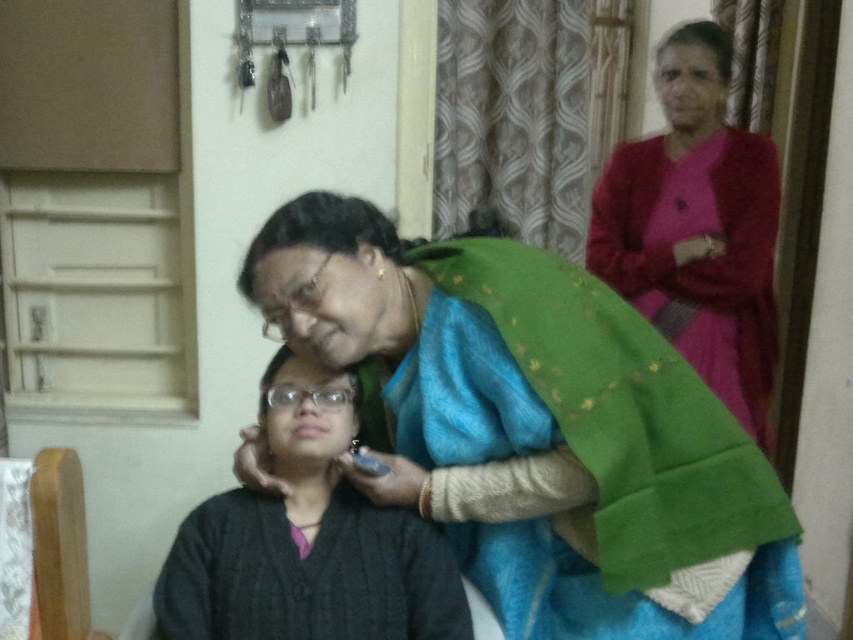
Is black knitted robe at lower center positioned in front of matte pink robe at upper right?

That is True.

Does black knitted robe at lower center have a larger size compared to matte pink robe at upper right?

Incorrect, black knitted robe at lower center is not larger than matte pink robe at upper right.

Where is `black knitted robe at lower center`? The image size is (853, 640). black knitted robe at lower center is located at coordinates (308, 573).

Locate an element on the screen. Image resolution: width=853 pixels, height=640 pixels. black knitted robe at lower center is located at coordinates (308, 573).

Is point (616, 305) positioned after point (340, 616)?

That is False.

Can you confirm if green silk saree at center is bigger than black knitted robe at lower center?

Indeed, green silk saree at center has a larger size compared to black knitted robe at lower center.

Find the location of a particular element. Image resolution: width=853 pixels, height=640 pixels. green silk saree at center is located at coordinates (619, 410).

The image size is (853, 640). Find the location of `green silk saree at center`. green silk saree at center is located at coordinates (619, 410).

Does green silk saree at center have a lesser width compared to matte pink robe at upper right?

No, green silk saree at center is not thinner than matte pink robe at upper right.

Between point (467, 288) and point (648, 234), which one is positioned in front?

Point (467, 288) is in front.

Locate an element on the screen. This screenshot has width=853, height=640. green silk saree at center is located at coordinates (619, 410).